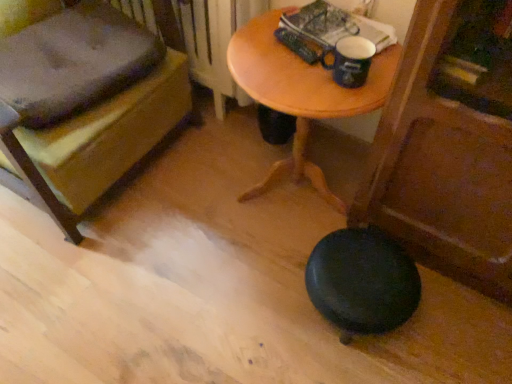
Measure the distance between point (312, 75) and camera.

A distance of 1.17 meters exists between point (312, 75) and camera.

Based on the photo, what is the approximate width of white plastic radiator at upper center?

2.75 inches.

The width and height of the screenshot is (512, 384). I want to click on white plastic radiator at upper center, so click(200, 36).

The height and width of the screenshot is (384, 512). I want to click on wooden bench at lower left, so click(x=39, y=186).

Is blue ceramic mug at upper center completely or partially inside wooden table at center?

No, blue ceramic mug at upper center is not a part of wooden table at center.

Is the surface of wooden table at center in direct contact with blue ceramic mug at upper center?

No, wooden table at center is not touching blue ceramic mug at upper center.

From a real-world perspective, is wooden table at center below blue ceramic mug at upper center?

Yes, from a real-world perspective, wooden table at center is below blue ceramic mug at upper center.

The width and height of the screenshot is (512, 384). I want to click on mug on the right side of wooden table at center, so click(x=350, y=61).

Is wooden bench at lower left facing towards black rubber stool at lower right?

Yes, wooden bench at lower left faces towards black rubber stool at lower right.

Is wooden bench at lower left far away from black rubber stool at lower right?

Actually, wooden bench at lower left and black rubber stool at lower right are a little close together.

Which is behind, point (61, 0) or point (345, 250)?

Point (61, 0)

Would you say wooden bench at lower left is outside black rubber stool at lower right?

Yes, wooden bench at lower left is not within black rubber stool at lower right.

Can you confirm if wooden bench at lower left is taller than white plastic radiator at upper center?

Yes.

From the picture: Choose the correct answer: Is wooden bench at lower left inside white plastic radiator at upper center or outside it?

wooden bench at lower left is spatially situated outside white plastic radiator at upper center.

From the picture: Who is bigger, wooden bench at lower left or white plastic radiator at upper center?

With larger size is wooden bench at lower left.

Between wooden bench at lower left and white plastic radiator at upper center, which one has larger width?

Wider between the two is wooden bench at lower left.

From the image's perspective, is blue ceramic mug at upper center located above or below black rubber stool at lower right?

blue ceramic mug at upper center is above black rubber stool at lower right.

Who is more distant, blue ceramic mug at upper center or black rubber stool at lower right?

black rubber stool at lower right is further away from the camera.

From a real-world perspective, is blue ceramic mug at upper center on black rubber stool at lower right?

Indeed, from a real-world perspective, blue ceramic mug at upper center stands above black rubber stool at lower right.

You are a GUI agent. You are given a task and a screenshot of the screen. Output one action in this format:
    pyautogui.click(x=<x>, y=<y>)
    Task: Click on the stool behind the blue ceramic mug at upper center
    The height and width of the screenshot is (384, 512).
    Given the screenshot: What is the action you would take?
    pyautogui.click(x=362, y=282)

Considering the relative sizes of white plastic radiator at upper center and black rubber stool at lower right in the image provided, is white plastic radiator at upper center thinner than black rubber stool at lower right?

Yes, white plastic radiator at upper center is thinner than black rubber stool at lower right.

Looking at this image, which is behind, white plastic radiator at upper center or black rubber stool at lower right?

white plastic radiator at upper center.

Is white plastic radiator at upper center outside of black rubber stool at lower right?

white plastic radiator at upper center lies outside black rubber stool at lower right's area.

From the image's perspective, between white plastic radiator at upper center and black rubber stool at lower right, which one is located above?

white plastic radiator at upper center is shown above in the image.

Identify the location of table above the black rubber stool at lower right (from the image's perspective). (301, 94).

In the scene shown: From the image's perspective, who appears lower, wooden table at center or black rubber stool at lower right?

black rubber stool at lower right is shown below in the image.

Would you say wooden table at center contains black rubber stool at lower right?

Actually, black rubber stool at lower right is outside wooden table at center.

Considering the points (285, 95) and (367, 246), which point is in front, point (285, 95) or point (367, 246)?

The point (285, 95) is closer.

Where is `table above the black rubber stool at lower right (from the image's perspective)`? This screenshot has height=384, width=512. table above the black rubber stool at lower right (from the image's perspective) is located at coordinates (301, 94).

Between black rubber stool at lower right and wooden table at center, which one has smaller size?

black rubber stool at lower right is smaller.

Which is in front, point (346, 333) or point (258, 51)?

The point (258, 51) is more forward.

Can you tell me how much black rubber stool at lower right and wooden table at center differ in facing direction?

The angular difference between black rubber stool at lower right and wooden table at center is 5.14 degrees.

The height and width of the screenshot is (384, 512). What are the coordinates of `table below the blue ceramic mug at upper center (from a real-world perspective)` in the screenshot? It's located at (301, 94).

In order to click on furniture located on the left of black rubber stool at lower right in this screenshot , I will do `click(39, 186)`.

Estimate the real-world distances between objects in this image. Which object is closer to black rubber stool at lower right, blue ceramic mug at upper center or wooden table at center?

Based on the image, wooden table at center appears to be nearer to black rubber stool at lower right.

Based on their spatial positions, is wooden table at center or blue ceramic mug at upper center further from white plastic radiator at upper center?

blue ceramic mug at upper center is positioned further to the anchor white plastic radiator at upper center.

From the picture: Which object lies further to the anchor point wooden table at center, black rubber stool at lower right or blue ceramic mug at upper center?

Among the two, black rubber stool at lower right is located further to wooden table at center.

Estimate the real-world distances between objects in this image. Which object is further from black rubber stool at lower right, wooden bench at lower left or blue ceramic mug at upper center?

wooden bench at lower left is further to black rubber stool at lower right.

Based on their spatial positions, is wooden bench at lower left or blue ceramic mug at upper center further from white plastic radiator at upper center?

wooden bench at lower left lies further to white plastic radiator at upper center than the other object.

Based on their spatial positions, is white plastic radiator at upper center or wooden bench at lower left closer to blue ceramic mug at upper center?

white plastic radiator at upper center is positioned closer to the anchor blue ceramic mug at upper center.

Considering their positions, is wooden table at center positioned further to white plastic radiator at upper center than wooden bench at lower left?

Based on the image, wooden bench at lower left appears to be further to white plastic radiator at upper center.

Estimate the real-world distances between objects in this image. Which object is closer to blue ceramic mug at upper center, wooden bench at lower left or white plastic radiator at upper center?

Based on the image, white plastic radiator at upper center appears to be nearer to blue ceramic mug at upper center.

At what (x,y) coordinates should I click in order to perform the action: click on radiator situated between wooden bench at lower left and black rubber stool at lower right from left to right. Please return your answer as a coordinate pair (x, y). The width and height of the screenshot is (512, 384). Looking at the image, I should click on (200, 36).

What are the coordinates of `radiator between wooden bench at lower left and blue ceramic mug at upper center from left to right` in the screenshot? It's located at (200, 36).

The image size is (512, 384). I want to click on table between white plastic radiator at upper center and blue ceramic mug at upper center in the horizontal direction, so click(x=301, y=94).

This screenshot has height=384, width=512. I want to click on table located between wooden bench at lower left and black rubber stool at lower right in the left-right direction, so click(x=301, y=94).